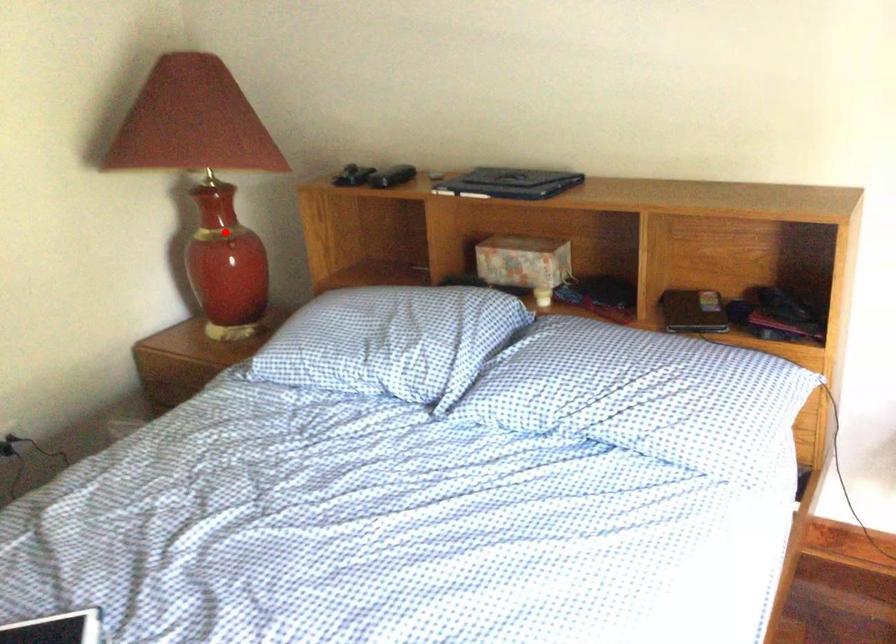
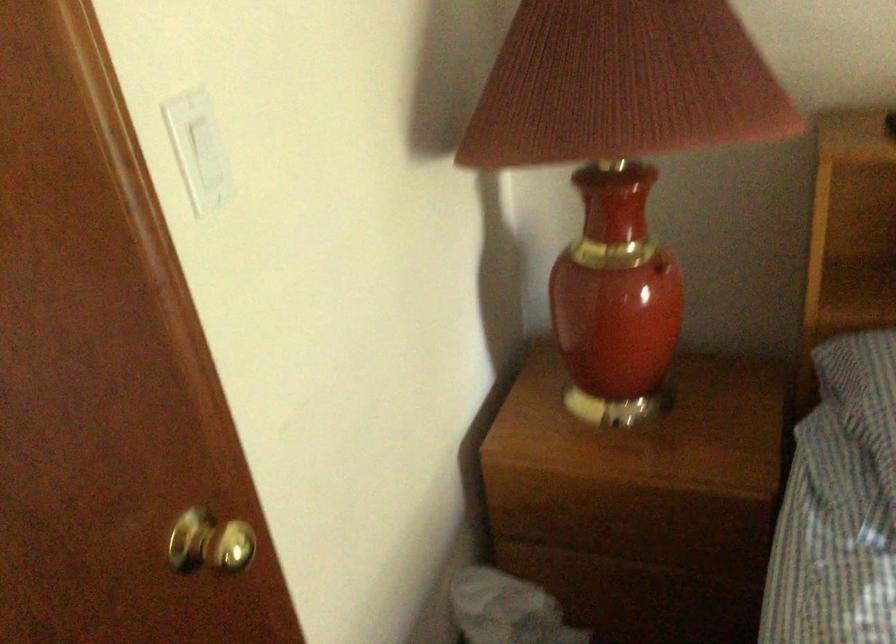
Question: I am providing you with two images of the same scene from different viewpoints. Given a red point in image1, look at the same physical point in image2. Is it:

Choices:
 (A) Closer to the viewpoint
 (B) Farther from the viewpoint

Answer: (A)